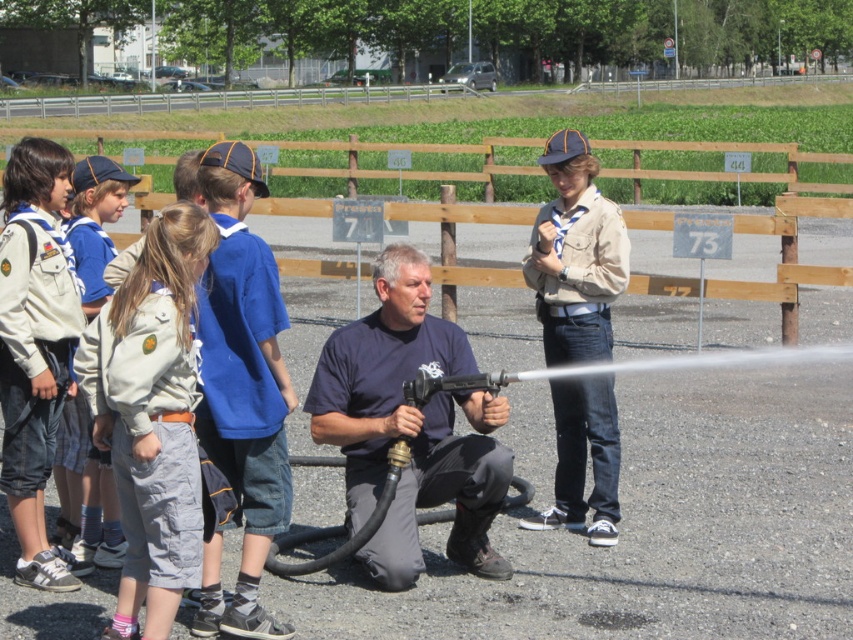
Question: Which of the following is the farthest from the observer?

Choices:
 (A) white cotton shirt at left
 (B) blue cotton shirt at left
 (C) khaki uniform at left
 (D) wooden fence at center

Answer: (C)

Question: Which object appears closest to the camera in this image?

Choices:
 (A) blue cotton shirt at left
 (B) white cotton shirt at left
 (C) khaki uniform at left
 (D) camouflage pants at left

Answer: (D)

Question: Is the position of camouflage pants at left less distant than that of khaki uniform at left?

Choices:
 (A) no
 (B) yes

Answer: (B)

Question: Is dark blue fabric shirt at center positioned in front of wooden fence at center?

Choices:
 (A) yes
 (B) no

Answer: (B)

Question: Which object is farther from the camera taking this photo?

Choices:
 (A) blue cotton shirt at left
 (B) white cotton shirt at left

Answer: (B)

Question: Can you confirm if white cotton shirt at left is positioned to the right of wooden fence at center?

Choices:
 (A) no
 (B) yes

Answer: (A)